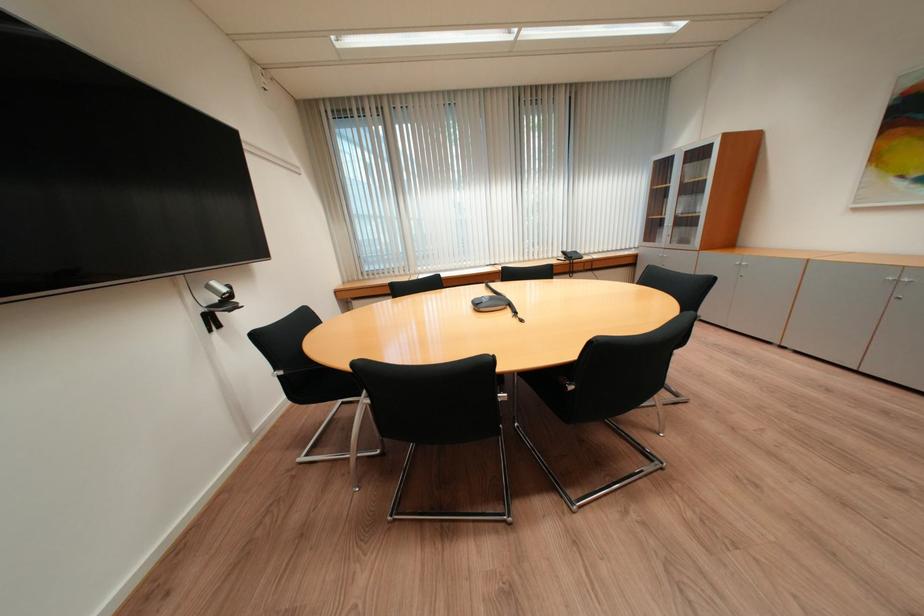
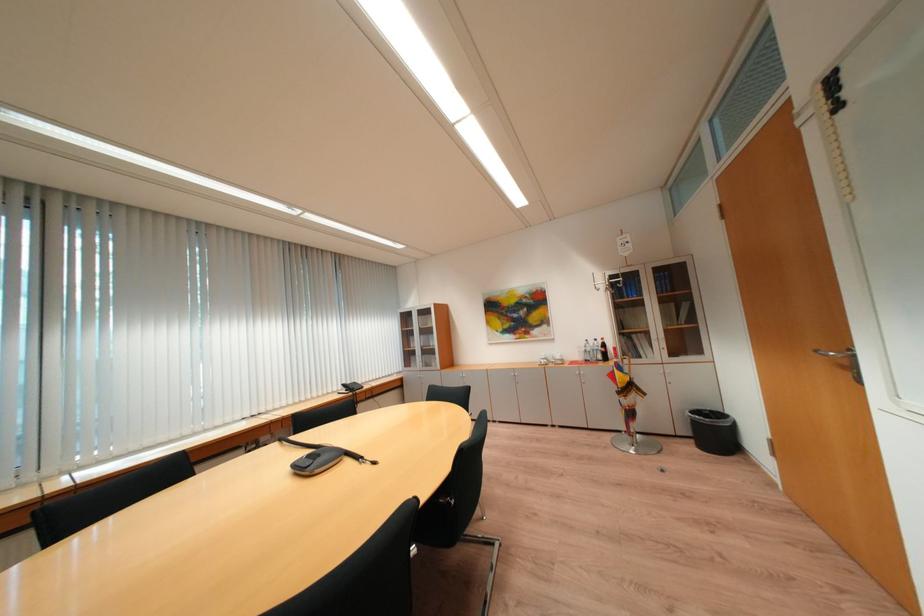
Based on the photo, how did the camera likely rotate?

The camera rotated toward right-up.